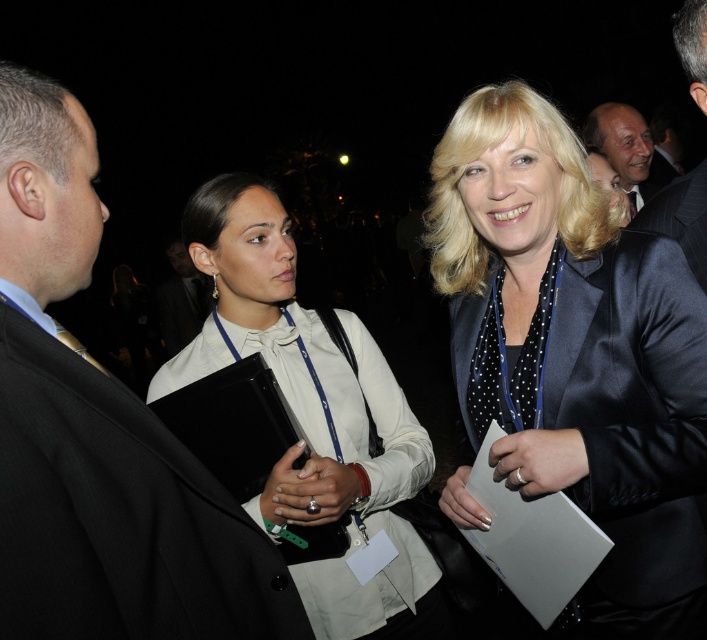
Between point (40, 291) and point (607, 104), which one is positioned behind?

Point (607, 104)

Does point (25, 390) lie behind point (643, 172)?

No.

You are a GUI agent. You are given a task and a screenshot of the screen. Output one action in this format:
    pyautogui.click(x=<x>, y=<y>)
    Task: Click on the black suit at left
    Image resolution: width=707 pixels, height=640 pixels.
    Given the screenshot: What is the action you would take?
    pyautogui.click(x=99, y=433)

Is white satin blouse at center thinner than dark suit jacket at upper right?

Indeed, white satin blouse at center has a lesser width compared to dark suit jacket at upper right.

Is white satin blouse at center to the right of dark suit jacket at upper right from the viewer's perspective?

Incorrect, white satin blouse at center is not on the right side of dark suit jacket at upper right.

Does point (436, 579) lie in front of point (655, 138)?

That is True.

The height and width of the screenshot is (640, 707). In order to click on white satin blouse at center in this screenshot , I will do `click(315, 419)`.

Who is positioned more to the left, satin black jacket at center or matte black suit at upper right?

satin black jacket at center

Is point (571, 323) more distant than point (590, 129)?

No, (571, 323) is in front of (590, 129).

Identify the location of satin black jacket at center. (573, 356).

The image size is (707, 640). I want to click on satin black jacket at center, so click(573, 356).